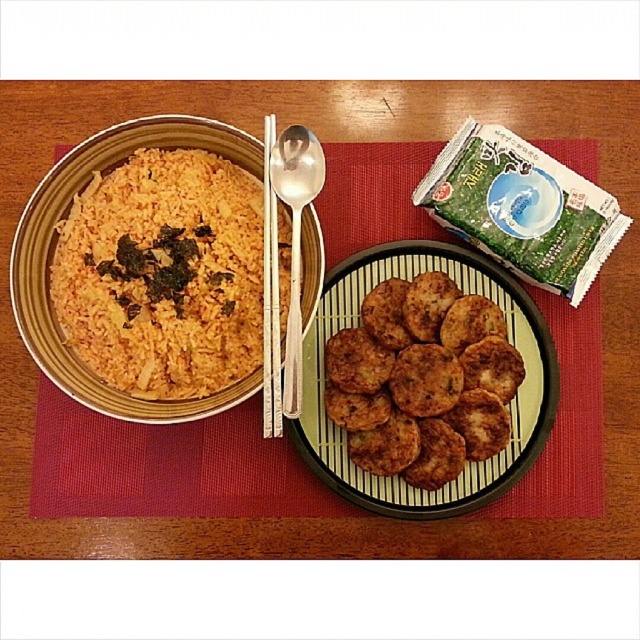
Consider the image. You are a chef preparing to serve a meal and need to place the green matte seaweed packet at upper right and the white wood chopsticks at upper center on the table. If the table is 36 inches wide, will both items fit side by side without overlapping?

The distance between the green matte seaweed packet at upper right and white wood chopsticks at upper center is 14.71 inches. Since the table is 36 inches wide, there is sufficient space to place both items side by side without overlapping.

You are a guest at a dinner table with the green matte seaweed packet at upper right and the white wood chopsticks at upper center. If you want to use the chopsticks, should you move the seaweed packet first?

The green matte seaweed packet at upper right is positioned over white wood chopsticks at upper center, so you need to move the seaweed packet first to access the chopsticks.

Consider the image. You are a diner at the table with the brown crispy patties at center and the silver metallic spoon at center. Which object is positioned to the left of the other?

The silver metallic spoon at center is to the left of the brown crispy patties at center.